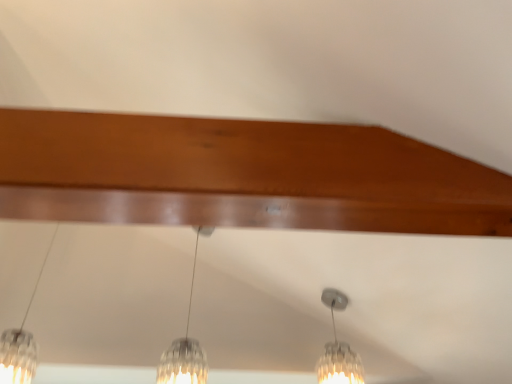
This screenshot has height=384, width=512. I want to click on clear glass pendant light at left, placed as the 3th lamp when sorted from right to left, so click(21, 344).

Identify the location of clear glass pendant light at left, placed as the 3th lamp when sorted from right to left. The image size is (512, 384). (21, 344).

Is clear glass pendant light at left, placed as the 3th lamp when sorted from right to left, at the back of clear glass pendant light at center, the third lamp from the left?

That's not correct — clear glass pendant light at center, the third lamp from the left, is not looking away from clear glass pendant light at left, placed as the 3th lamp when sorted from right to left.

Is clear glass pendant light at center, the third lamp from the left, located outside clear glass pendant light at left, the first lamp when ordered from left to right?

Yes, clear glass pendant light at center, the third lamp from the left, is outside of clear glass pendant light at left, the first lamp when ordered from left to right.

Which object is thinner, clear glass pendant light at center, positioned as the first lamp in right-to-left order, or clear glass pendant light at left, the first lamp when ordered from left to right?

clear glass pendant light at center, positioned as the first lamp in right-to-left order, is thinner.

Can you tell me how much clear glass pendant light at center, positioned as the first lamp in right-to-left order, and clear glass pendant light at left, placed as the 3th lamp when sorted from right to left, differ in facing direction?

The angular difference between clear glass pendant light at center, positioned as the first lamp in right-to-left order, and clear glass pendant light at left, placed as the 3th lamp when sorted from right to left, is 0.00124 degrees.

Is clear glass pendant light at left, placed as the 3th lamp when sorted from right to left, in front of or behind clear glass pendant light at center, the third lamp from the left, in the image?

Clearly, clear glass pendant light at left, placed as the 3th lamp when sorted from right to left, is in front of clear glass pendant light at center, the third lamp from the left.

Who is shorter, clear glass pendant light at left, the first lamp when ordered from left to right, or clear glass pendant light at center, positioned as the first lamp in right-to-left order?

clear glass pendant light at center, positioned as the first lamp in right-to-left order.

Is clear glass pendant light at left, the first lamp when ordered from left to right, in contact with clear glass pendant light at center, positioned as the first lamp in right-to-left order?

No, clear glass pendant light at left, the first lamp when ordered from left to right, is not with clear glass pendant light at center, positioned as the first lamp in right-to-left order.

From the image's perspective, is clear glass pendant light at left, placed as the 3th lamp when sorted from right to left, located beneath clear glass pendant light at center, positioned as the first lamp in right-to-left order?

Incorrect, from the image's perspective, clear glass pendant light at left, placed as the 3th lamp when sorted from right to left, is higher than clear glass pendant light at center, positioned as the first lamp in right-to-left order.

How many degrees apart are the facing directions of clear glass pendant light at center, positioned as the first lamp in right-to-left order, and clear glass pendant light at center, which appears as the second lamp when viewed from the left?

0.00163 degrees.

Is clear glass pendant light at center, positioned as the first lamp in right-to-left order, taller than clear glass pendant light at center, which appears as the second lamp when viewed from the left?

Incorrect, the height of clear glass pendant light at center, positioned as the first lamp in right-to-left order, is not larger of that of clear glass pendant light at center, which appears as the second lamp when viewed from the left.

Does clear glass pendant light at center, the third lamp from the left, contain clear glass pendant light at center, which appears as the second lamp when viewed from the left?

No.

Which object is further away from the camera taking this photo, clear glass pendant light at left, placed as the 3th lamp when sorted from right to left, or clear glass pendant light at center, which appears as the second lamp when viewed from the left?

clear glass pendant light at center, which appears as the second lamp when viewed from the left, is behind.

Where is `lamp above the clear glass pendant light at left, the first lamp when ordered from left to right (from a real-world perspective)`? lamp above the clear glass pendant light at left, the first lamp when ordered from left to right (from a real-world perspective) is located at coordinates (185, 347).

In the scene shown: Considering the sizes of objects clear glass pendant light at left, placed as the 3th lamp when sorted from right to left, and clear glass pendant light at center, which appears as the second lamp when viewed from the left, in the image provided, who is thinner, clear glass pendant light at left, placed as the 3th lamp when sorted from right to left, or clear glass pendant light at center, which appears as the second lamp when viewed from the left,?

With smaller width is clear glass pendant light at center, which appears as the second lamp when viewed from the left.

Does clear glass pendant light at left, placed as the 3th lamp when sorted from right to left, have a greater height compared to clear glass pendant light at center, positioned as the second lamp in right-to-left order?

In fact, clear glass pendant light at left, placed as the 3th lamp when sorted from right to left, may be shorter than clear glass pendant light at center, positioned as the second lamp in right-to-left order.

How different are the orientations of clear glass pendant light at center, which appears as the second lamp when viewed from the left, and clear glass pendant light at left, placed as the 3th lamp when sorted from right to left, in degrees?

They differ by 0.000641 degrees in their facing directions.

From the image's perspective, between clear glass pendant light at center, which appears as the second lamp when viewed from the left, and clear glass pendant light at left, the first lamp when ordered from left to right, who is located below?

clear glass pendant light at center, which appears as the second lamp when viewed from the left, is shown below in the image.

Is clear glass pendant light at center, positioned as the second lamp in right-to-left order, closer to camera compared to clear glass pendant light at left, placed as the 3th lamp when sorted from right to left?

That is False.

Is clear glass pendant light at center, positioned as the second lamp in right-to-left order, positioned with its back to clear glass pendant light at left, placed as the 3th lamp when sorted from right to left?

No.

Identify the location of lamp located behind the clear glass pendant light at center, positioned as the second lamp in right-to-left order. Image resolution: width=512 pixels, height=384 pixels. (338, 350).

Is clear glass pendant light at center, positioned as the second lamp in right-to-left order, looking in the opposite direction of clear glass pendant light at center, the third lamp from the left?

Yes, clear glass pendant light at center, positioned as the second lamp in right-to-left order,'s orientation is away from clear glass pendant light at center, the third lamp from the left.

Which of these two, clear glass pendant light at center, which appears as the second lamp when viewed from the left, or clear glass pendant light at center, positioned as the first lamp in right-to-left order, is bigger?

With larger size is clear glass pendant light at center, which appears as the second lamp when viewed from the left.

Identify the location of lamp that is the 2nd object located below the clear glass pendant light at left, placed as the 3th lamp when sorted from right to left (from the image's perspective). (338, 350).

I want to click on lamp that is the 2nd object to the right of the clear glass pendant light at left, the first lamp when ordered from left to right, starting at the anchor, so click(x=338, y=350).

From the image, which object appears to be nearer to clear glass pendant light at center, which appears as the second lamp when viewed from the left, clear glass pendant light at center, positioned as the first lamp in right-to-left order, or clear glass pendant light at left, the first lamp when ordered from left to right?

clear glass pendant light at left, the first lamp when ordered from left to right.

Estimate the real-world distances between objects in this image. Which object is closer to clear glass pendant light at center, positioned as the first lamp in right-to-left order, clear glass pendant light at center, positioned as the second lamp in right-to-left order, or clear glass pendant light at left, the first lamp when ordered from left to right?

The object closer to clear glass pendant light at center, positioned as the first lamp in right-to-left order, is clear glass pendant light at center, positioned as the second lamp in right-to-left order.

Based on their spatial positions, is clear glass pendant light at left, placed as the 3th lamp when sorted from right to left, or clear glass pendant light at center, which appears as the second lamp when viewed from the left, closer to clear glass pendant light at center, positioned as the first lamp in right-to-left order?

Based on the image, clear glass pendant light at center, which appears as the second lamp when viewed from the left, appears to be nearer to clear glass pendant light at center, positioned as the first lamp in right-to-left order.

Looking at this image, based on their spatial positions, is clear glass pendant light at left, the first lamp when ordered from left to right, or clear glass pendant light at center, the third lamp from the left, further from clear glass pendant light at center, positioned as the second lamp in right-to-left order?

clear glass pendant light at center, the third lamp from the left.

From the image, which object appears to be farther from clear glass pendant light at left, placed as the 3th lamp when sorted from right to left, clear glass pendant light at center, the third lamp from the left, or clear glass pendant light at center, positioned as the second lamp in right-to-left order?

clear glass pendant light at center, the third lamp from the left.

When comparing their distances from clear glass pendant light at left, placed as the 3th lamp when sorted from right to left, does clear glass pendant light at center, which appears as the second lamp when viewed from the left, or clear glass pendant light at center, the third lamp from the left, seem further?

clear glass pendant light at center, the third lamp from the left, is further to clear glass pendant light at left, placed as the 3th lamp when sorted from right to left.

The image size is (512, 384). I want to click on lamp located between clear glass pendant light at left, the first lamp when ordered from left to right, and clear glass pendant light at center, the third lamp from the left, in the left-right direction, so click(x=185, y=347).